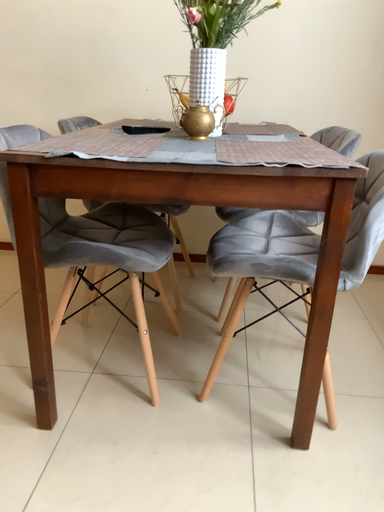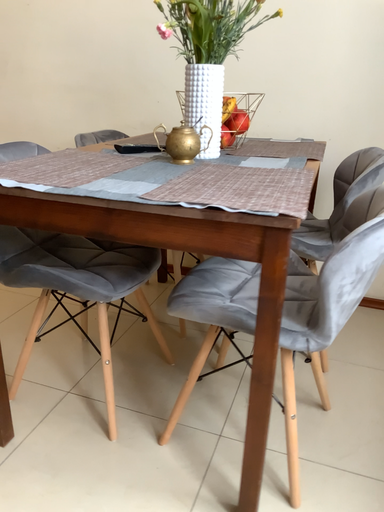
Question: How did the camera likely rotate when shooting the video?

Choices:
 (A) rotated right
 (B) rotated left

Answer: (B)